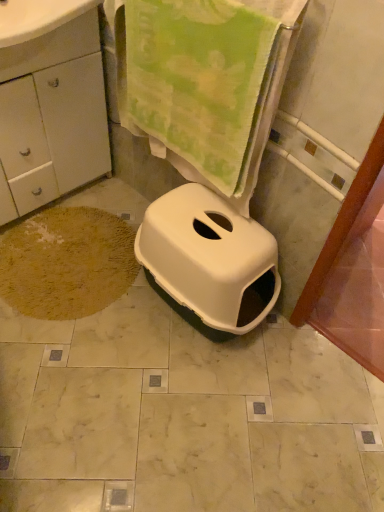
This screenshot has height=512, width=384. In order to click on unoccupied region to the right of white plastic litter box at center in this screenshot , I will do `click(297, 361)`.